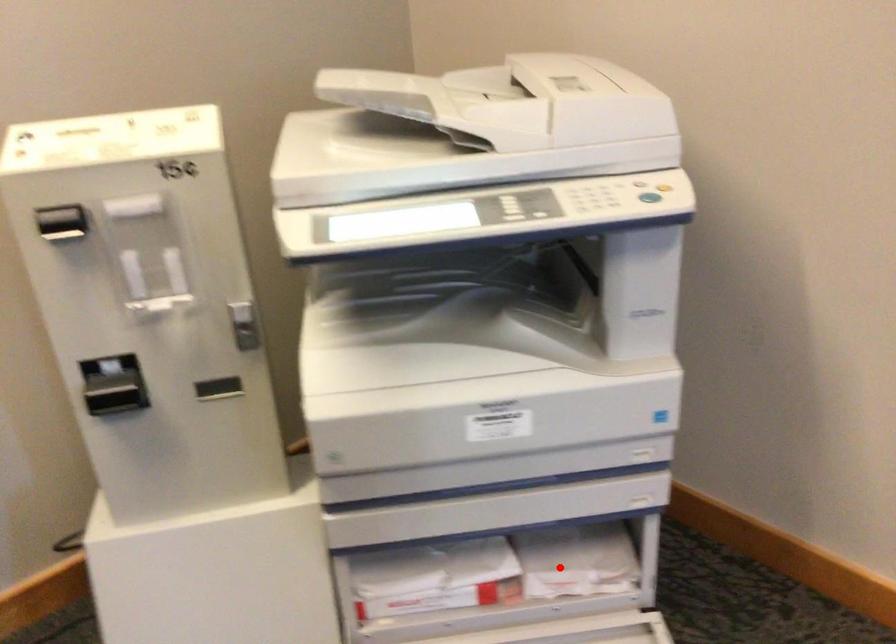
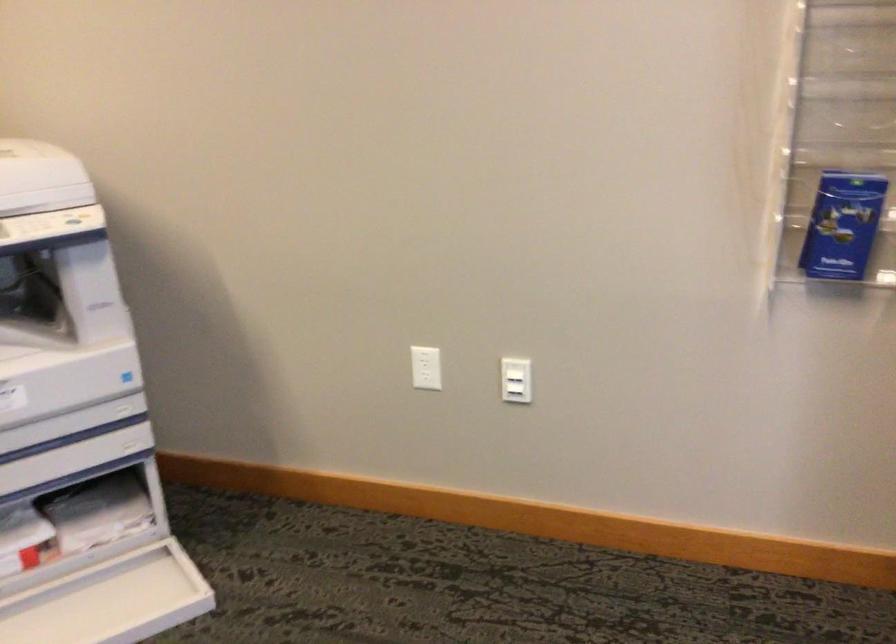
Locate, in the second image, the point that corresponds to the highlighted location in the first image.

(91, 523)